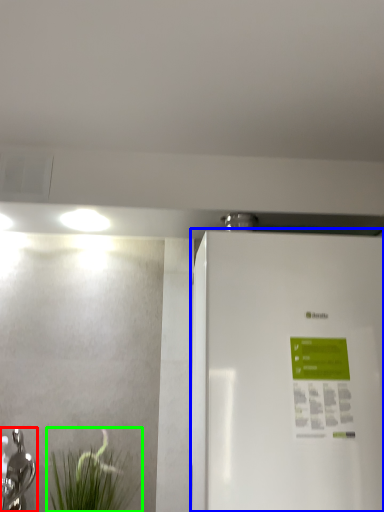
Question: Estimate the real-world distances between objects in this image. Which object is closer to tap (highlighted by a red box), refrigerator (highlighted by a blue box) or plant (highlighted by a green box)?

Choices:
 (A) refrigerator
 (B) plant

Answer: (B)